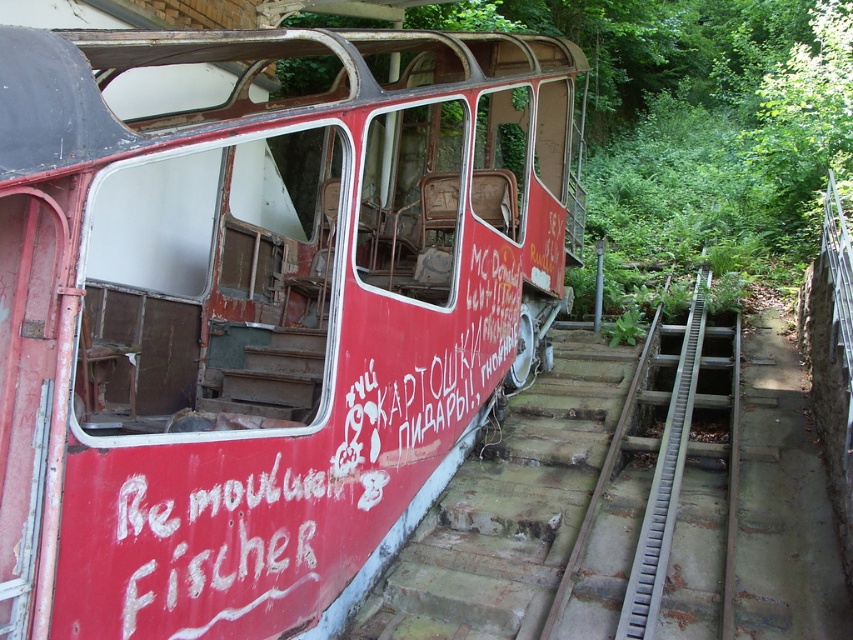
From the picture: You are a maintenance worker inspecting the tracks of an abandoned tram system. You notice two metallic structures on the ground. One is the gray metallic train track at center and the other is the metallic gray rail at right. Which one is bigger in size?

The gray metallic train track at center is larger in size compared to the metallic gray rail at right.

You are a maintenance worker who needs to replace a damaged section of track. You have a replacement track piece that is 36 inches long. Can you use this piece to fill the gap between the gray metallic train track at center and the metallic gray rail at right?

The gap between the gray metallic train track at center and the metallic gray rail at right is 38.76 inches. The replacement track piece is only 36 inches long, which is shorter than the required distance. Therefore, the replacement track piece cannot be used to fill the gap.

You are a maintenance worker inspecting the tracks of the abandoned tram. You notice the gray metallic train track at center and the metallic gray rail at right. Which one is closer to you as you stand in front of the tram?

The gray metallic train track at center is closer to you because it is in front of the metallic gray rail at right.